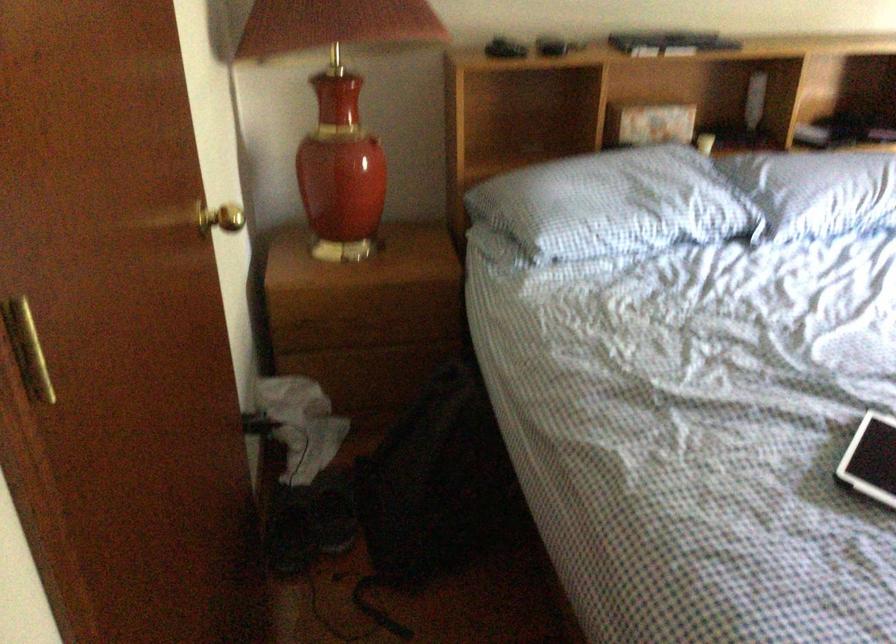
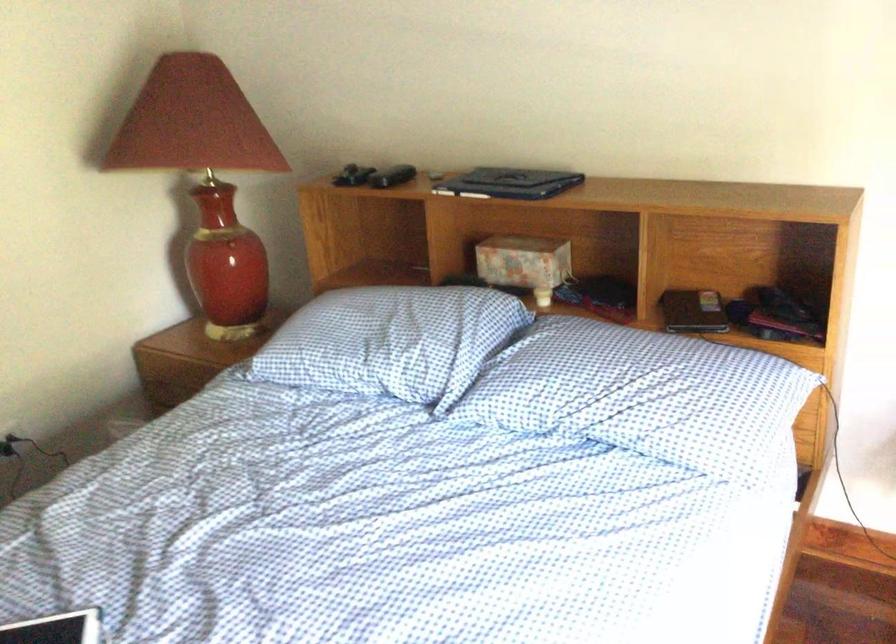
In the second image, find the point that corresponds to point 655,198 in the first image.

(384, 342)